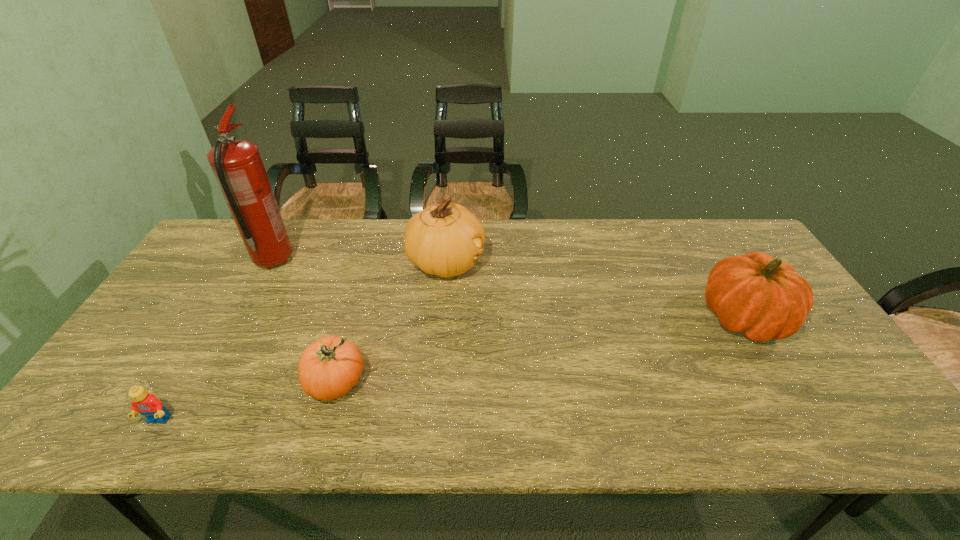
Identify the location of free location at the far edge of the desktop. Image resolution: width=960 pixels, height=540 pixels. (287, 220).

Where is `vacant space at the near edge of the desktop`? The width and height of the screenshot is (960, 540). vacant space at the near edge of the desktop is located at coordinates (203, 435).

Find the location of a particular element. This screenshot has height=540, width=960. free location at the left edge of the desktop is located at coordinates (103, 384).

The image size is (960, 540). What are the coordinates of `vacant space at the far right corner of the desktop` in the screenshot? It's located at (708, 237).

In the image, there is a desktop. Identify the location of vacant space at the near right corner. The height and width of the screenshot is (540, 960). (870, 441).

Identify the location of vacant point located between the fire extinguisher and the fourth object from left to right. The width and height of the screenshot is (960, 540). (360, 261).

The width and height of the screenshot is (960, 540). What are the coordinates of `empty space between the fourth object from left to right and the tallest object` in the screenshot? It's located at (360, 261).

Locate an element on the screen. The width and height of the screenshot is (960, 540). free area in between the fire extinguisher and the second pumpkin from right to left is located at coordinates (360, 261).

Where is `free space between the tallest object and the Lego`? free space between the tallest object and the Lego is located at coordinates (216, 341).

Find the location of a particular element. The width and height of the screenshot is (960, 540). unoccupied area between the second pumpkin from left to right and the tallest object is located at coordinates (360, 261).